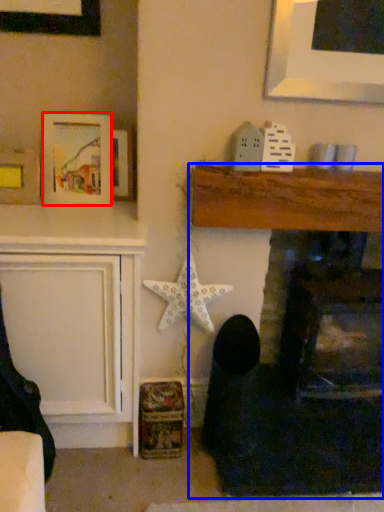
Question: Which object appears closest to the camera in this image, picture frame (highlighted by a red box) or fireplace (highlighted by a blue box)?

Choices:
 (A) picture frame
 (B) fireplace

Answer: (B)